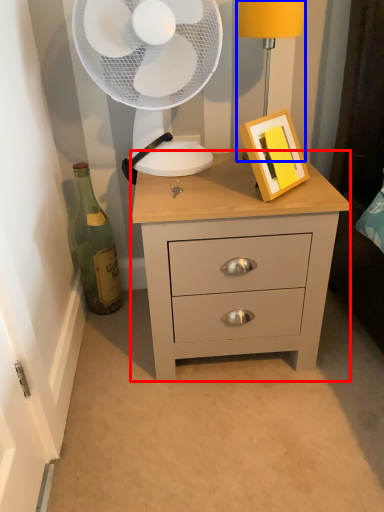
Question: Which point is further to the camera, chest of drawers (highlighted by a red box) or bedside lamp (highlighted by a blue box)?

Choices:
 (A) chest of drawers
 (B) bedside lamp

Answer: (B)